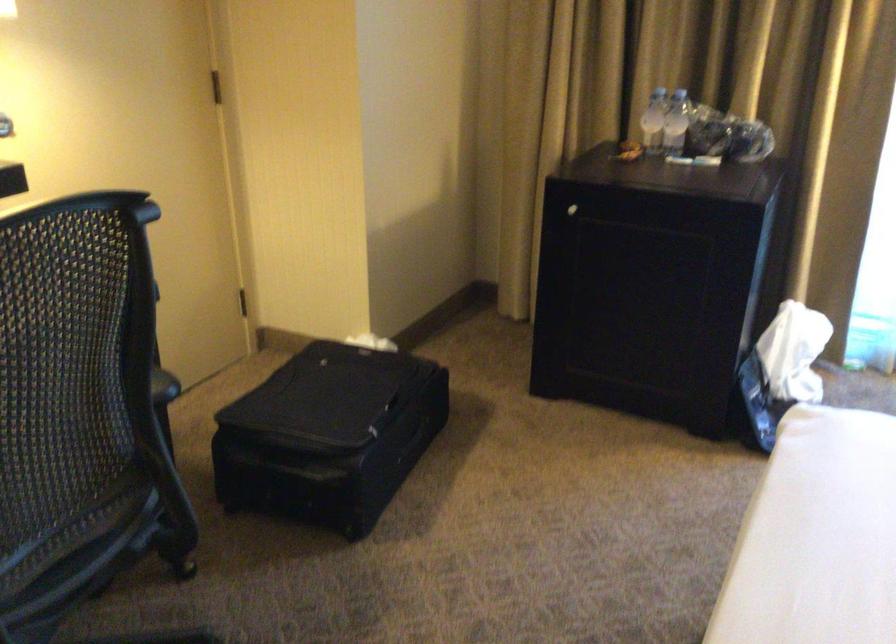
Describe the element at coordinates (572, 210) in the screenshot. I see `the cabinet door handle` at that location.